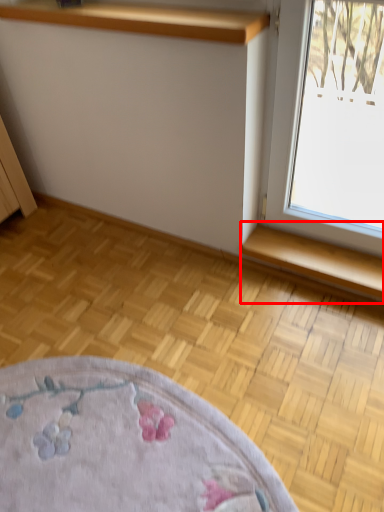
Question: From the image's perspective, what is the correct spatial relationship of window sill (annotated by the red box) in relation to shelf?

Choices:
 (A) below
 (B) above

Answer: (A)